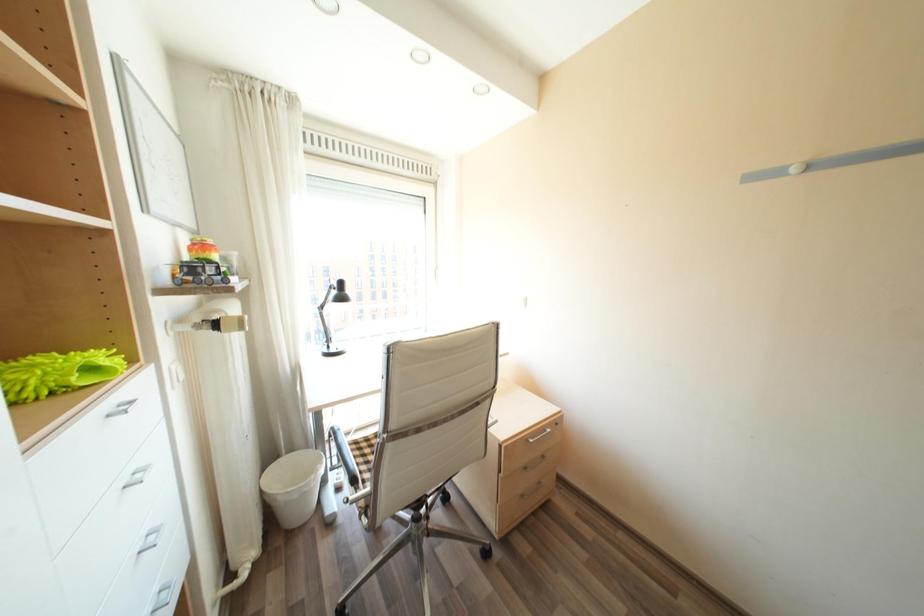
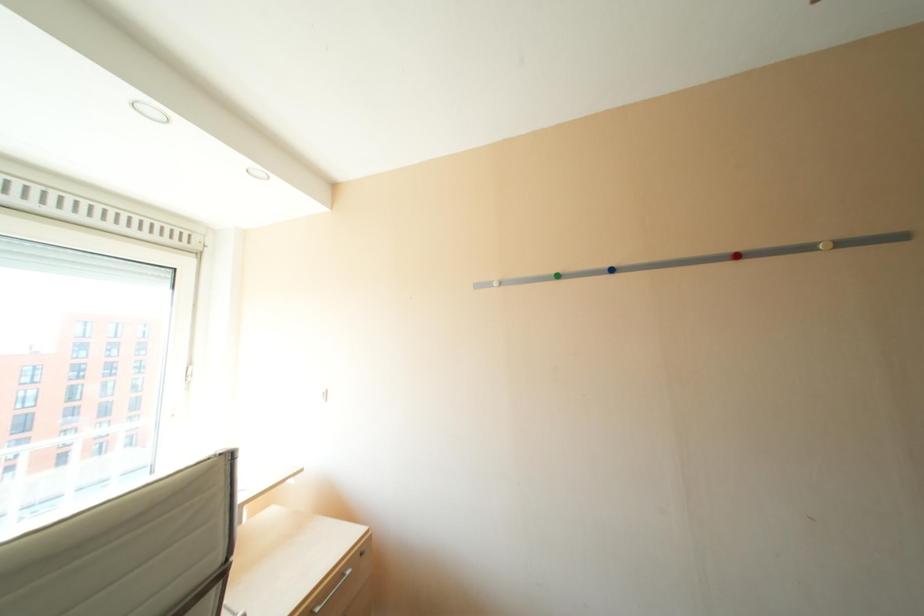
Question: Based on the continuous images, in which direction is the camera rotating? Reply with the corresponding letter.

Choices:
 (A) Left
 (B) Right
 (C) Up
 (D) Down

Answer: (B)